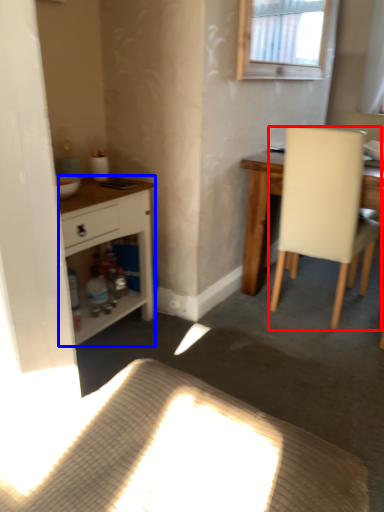
Question: Which object appears farthest to the camera in this image, chair (highlighted by a red box) or cabinetry (highlighted by a blue box)?

Choices:
 (A) chair
 (B) cabinetry

Answer: (A)